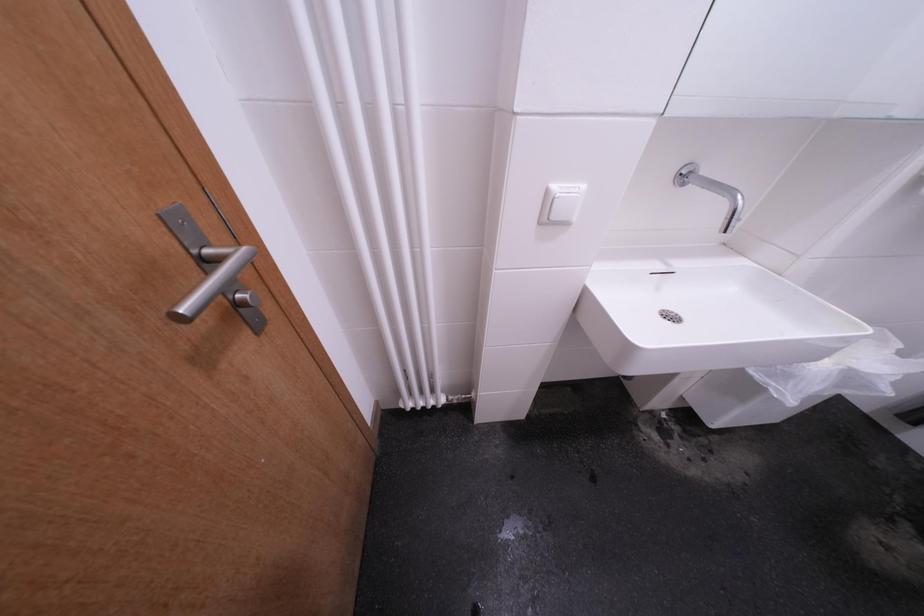
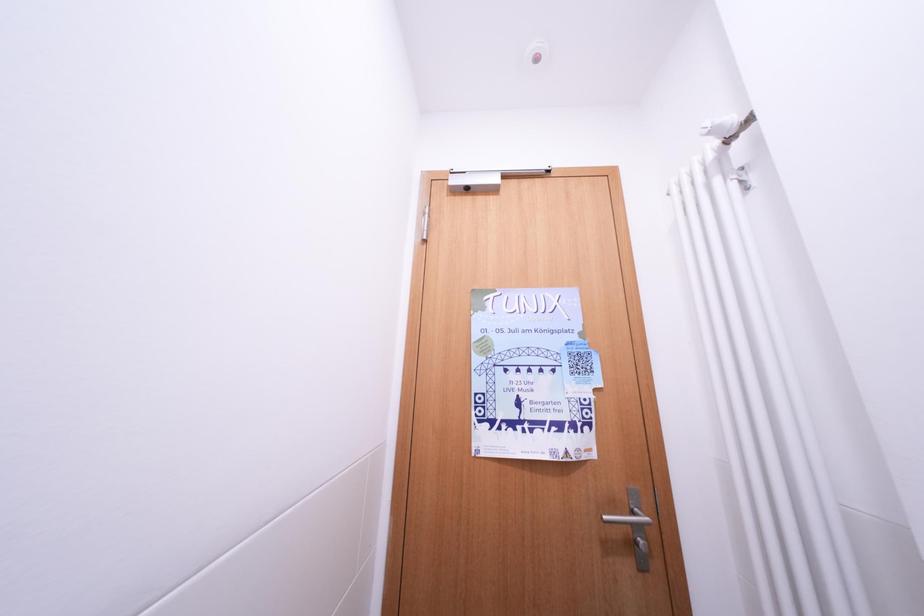
Question: The first image is from the beginning of the video and the second image is from the end. How did the camera likely rotate when shooting the video?

Choices:
 (A) Left
 (B) Right
 (C) Up
 (D) Down

Answer: (A)